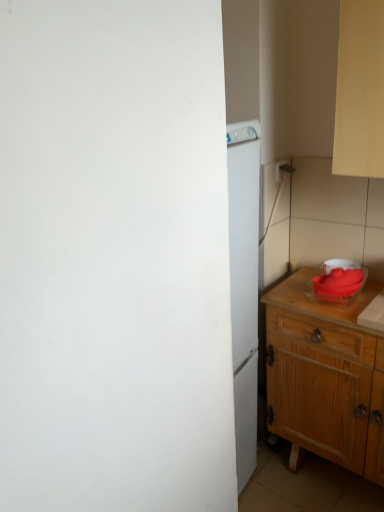
I want to click on vacant space in matte red bowl at right (from a real-world perspective), so click(334, 298).